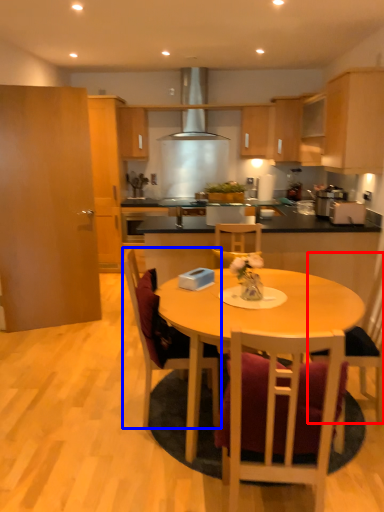
Question: Among these objects, which one is farthest to the camera, chair (highlighted by a red box) or chair (highlighted by a blue box)?

Choices:
 (A) chair
 (B) chair

Answer: (A)